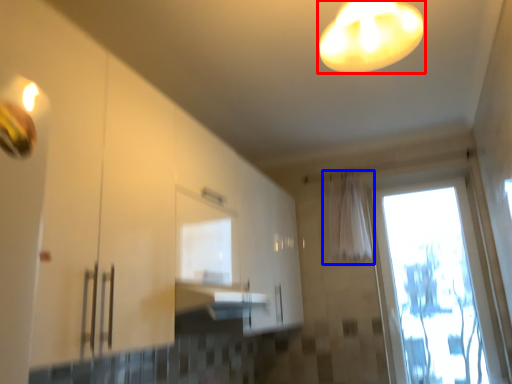
Question: Which point is closer to the camera, lamp (highlighted by a red box) or curtain (highlighted by a blue box)?

Choices:
 (A) lamp
 (B) curtain

Answer: (A)